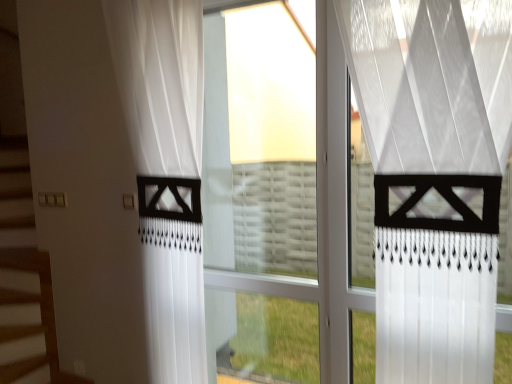
Question: Which direction should I rotate to look at white sheer curtain at center, which is the first curtain from front to back, — up or down?

Choices:
 (A) up
 (B) down

Answer: (B)

Question: Can you confirm if white sheer curtain at left, the 2th curtain viewed from the front, is positioned to the left of transparent glass window at center?

Choices:
 (A) yes
 (B) no

Answer: (A)

Question: Is white sheer curtain at left, the 1th curtain viewed from the back, closer to the viewer compared to transparent glass window at center?

Choices:
 (A) yes
 (B) no

Answer: (A)

Question: Is white sheer curtain at left, the 2th curtain viewed from the front, further to camera compared to transparent glass window at center?

Choices:
 (A) no
 (B) yes

Answer: (A)

Question: Would you say white sheer curtain at left, placed as the 1th curtain when sorted from left to right, contains transparent glass window at center?

Choices:
 (A) no
 (B) yes

Answer: (A)

Question: Considering the relative sizes of white sheer curtain at left, the 1th curtain viewed from the back, and transparent glass window at center in the image provided, is white sheer curtain at left, the 1th curtain viewed from the back, taller than transparent glass window at center?

Choices:
 (A) yes
 (B) no

Answer: (B)

Question: From the image's perspective, does white sheer curtain at left, the 1th curtain viewed from the back, appear lower than transparent glass window at center?

Choices:
 (A) yes
 (B) no

Answer: (B)

Question: Does white sheer curtain at center, placed as the 2th curtain when sorted from left to right, have a smaller size compared to transparent glass window at center?

Choices:
 (A) yes
 (B) no

Answer: (B)

Question: Is white sheer curtain at center, which is the first curtain from front to back, completely or partially outside of transparent glass window at center?

Choices:
 (A) yes
 (B) no

Answer: (A)

Question: Is white sheer curtain at center, the 1th curtain positioned from the right, turned away from transparent glass window at center?

Choices:
 (A) yes
 (B) no

Answer: (B)

Question: Considering the relative sizes of white sheer curtain at center, placed as the 2th curtain when sorted from left to right, and transparent glass window at center in the image provided, is white sheer curtain at center, placed as the 2th curtain when sorted from left to right, wider than transparent glass window at center?

Choices:
 (A) yes
 (B) no

Answer: (A)

Question: Is white sheer curtain at center, the 2th curtain positioned from the back, at the left side of transparent glass window at center?

Choices:
 (A) no
 (B) yes

Answer: (A)

Question: Considering the relative sizes of transparent glass window at center and white sheer curtain at left, which is the second curtain in right-to-left order, in the image provided, is transparent glass window at center shorter than white sheer curtain at left, which is the second curtain in right-to-left order,?

Choices:
 (A) no
 (B) yes

Answer: (A)